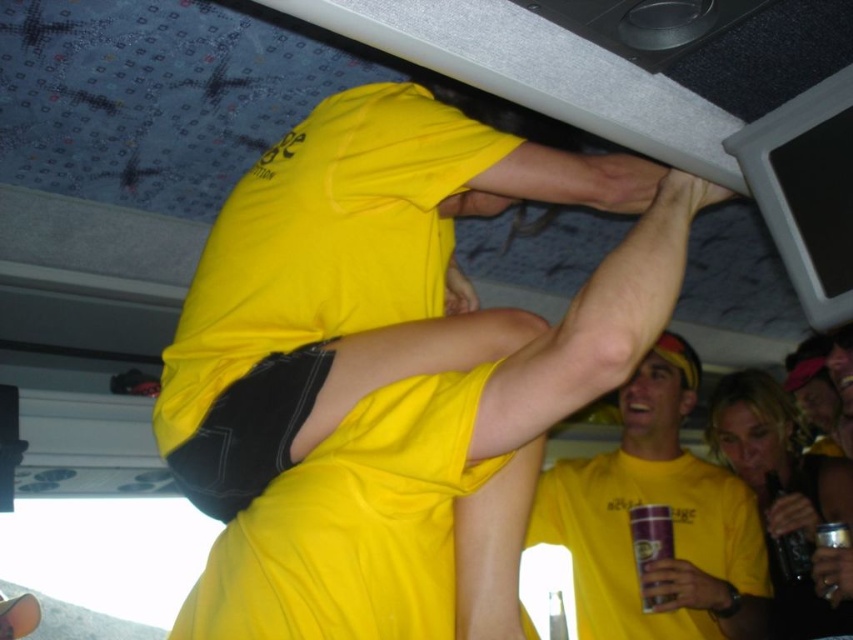
Can you confirm if yellow matte t-shirt at upper center is smaller than black glass bottle at lower right?

No, yellow matte t-shirt at upper center is not smaller than black glass bottle at lower right.

Is yellow matte t-shirt at upper center taller than black glass bottle at lower right?

Yes.

Between point (383, 349) and point (792, 529), which one is positioned in front?

Point (383, 349)

Where is `yellow matte t-shirt at upper center`? yellow matte t-shirt at upper center is located at coordinates (347, 278).

Does matte yellow t-shirt at upper center lie in front of black glass bottle at lower right?

Yes, it is.

Which is above, matte yellow t-shirt at upper center or black glass bottle at lower right?

Positioned higher is matte yellow t-shirt at upper center.

Does point (631, 600) come in front of point (791, 554)?

Yes.

This screenshot has height=640, width=853. Find the location of `matte yellow t-shirt at upper center`. matte yellow t-shirt at upper center is located at coordinates (671, 518).

Can you confirm if purple plastic cup at lower center is thinner than black glass bottle at lower right?

No.

Between point (636, 524) and point (804, 544), which one is positioned behind?

The point (804, 544) is more distant.

Is point (646, 525) more distant than point (798, 540)?

No, it is in front of (798, 540).

In order to click on purple plastic cup at lower center in this screenshot , I will do `click(650, 545)`.